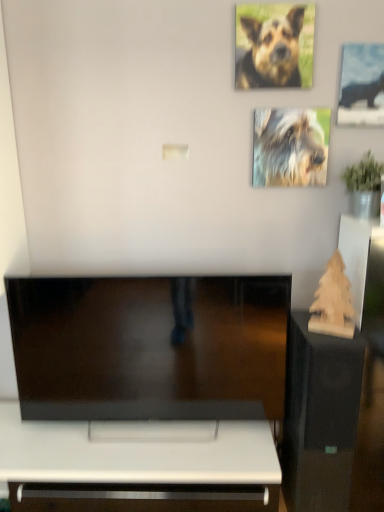
Describe the element at coordinates (271, 51) in the screenshot. I see `brown fur dog at upper right, which is the 1th dog from top to bottom` at that location.

This screenshot has height=512, width=384. What do you see at coordinates (361, 85) in the screenshot?
I see `metallic silver hippo at upper right` at bounding box center [361, 85].

This screenshot has height=512, width=384. What do you see at coordinates (333, 301) in the screenshot?
I see `wooden christmas tree at right` at bounding box center [333, 301].

Identify the location of brown fur dog at upper right, the 2th dog in the back-to-front sequence. This screenshot has height=512, width=384. 271,51.

Does brown fur dog at upper right, which is the 1th dog from top to bottom, appear on the right side of wooden sculpture at right?

No.

Which object is more forward, brown fur dog at upper right, which is the 1th dog from top to bottom, or wooden sculpture at right?

wooden sculpture at right is closer to the camera.

From a real-world perspective, is brown fur dog at upper right, positioned as the first dog in front-to-back order, above or below wooden sculpture at right?

Clearly, from a real-world perspective, brown fur dog at upper right, positioned as the first dog in front-to-back order, is above wooden sculpture at right.

Identify the location of furniture lying below the brown fur dog at upper right, which is the 1th dog from top to bottom (from the image's perspective). The height and width of the screenshot is (512, 384). (320, 417).

Which object is positioned more to the right, wooden sculpture at right or brown fur dog at upper right, positioned as the first dog in front-to-back order?

Positioned to the right is wooden sculpture at right.

From a real-world perspective, between wooden sculpture at right and brown fur dog at upper right, which is the 1th dog from top to bottom, who is vertically higher?

In real-world perspective, brown fur dog at upper right, which is the 1th dog from top to bottom, is above.

In terms of height, does wooden sculpture at right look taller or shorter compared to brown fur dog at upper right, the 2th dog in the back-to-front sequence?

Considering their sizes, wooden sculpture at right has more height than brown fur dog at upper right, the 2th dog in the back-to-front sequence.

From the picture: Is wooden sculpture at right wider or thinner than brown fur dog at upper right, which is the 1th dog from top to bottom?

Considering their sizes, wooden sculpture at right looks broader than brown fur dog at upper right, which is the 1th dog from top to bottom.

Measure the distance between wooden sculpture at right and shaggy fur dog at upper right, positioned as the 1th dog in back-to-front order.

They are 31.72 inches apart.

This screenshot has width=384, height=512. I want to click on furniture below the shaggy fur dog at upper right, positioned as the 1th dog in back-to-front order (from the image's perspective), so click(x=320, y=417).

Looking at this image, how many degrees apart are the facing directions of wooden sculpture at right and shaggy fur dog at upper right, arranged as the 1th dog when ordered from the bottom?

The angular difference between wooden sculpture at right and shaggy fur dog at upper right, arranged as the 1th dog when ordered from the bottom, is 0.479 degrees.

From a real-world perspective, is wooden sculpture at right positioned under shaggy fur dog at upper right, which ranks as the second dog in top-to-bottom order, based on gravity?

Indeed, from a real-world perspective, wooden sculpture at right is positioned beneath shaggy fur dog at upper right, which ranks as the second dog in top-to-bottom order.

From the picture: Is shaggy fur dog at upper right, which is the second dog from front to back, oriented away from brown fur dog at upper right, positioned as the first dog in front-to-back order?

shaggy fur dog at upper right, which is the second dog from front to back, is not turned away from brown fur dog at upper right, positioned as the first dog in front-to-back order.

From the image's perspective, between shaggy fur dog at upper right, arranged as the 1th dog when ordered from the bottom, and brown fur dog at upper right, arranged as the second dog when ordered from the bottom, which one is located above?

brown fur dog at upper right, arranged as the second dog when ordered from the bottom.

Is the surface of shaggy fur dog at upper right, positioned as the 1th dog in back-to-front order, in direct contact with brown fur dog at upper right, the 2th dog in the back-to-front sequence?

No, shaggy fur dog at upper right, positioned as the 1th dog in back-to-front order, is not touching brown fur dog at upper right, the 2th dog in the back-to-front sequence.

Considering the sizes of shaggy fur dog at upper right, which ranks as the second dog in top-to-bottom order, and brown fur dog at upper right, positioned as the first dog in front-to-back order, in the image, is shaggy fur dog at upper right, which ranks as the second dog in top-to-bottom order, taller or shorter than brown fur dog at upper right, positioned as the first dog in front-to-back order,?

Considering their sizes, shaggy fur dog at upper right, which ranks as the second dog in top-to-bottom order, has less height than brown fur dog at upper right, positioned as the first dog in front-to-back order.

Which of these two, wooden sculpture at right or wooden christmas tree at right, is thinner?

Thinner between the two is wooden christmas tree at right.

Considering the positions of points (301, 332) and (323, 288), is point (301, 332) closer to camera compared to point (323, 288)?

No, it is behind (323, 288).

Is wooden sculpture at right not near wooden christmas tree at right?

No.

Is wooden christmas tree at right turned away from brown fur dog at upper right, which is the 1th dog from top to bottom?

No, brown fur dog at upper right, which is the 1th dog from top to bottom, is not at the back of wooden christmas tree at right.

Considering the sizes of objects wooden christmas tree at right and brown fur dog at upper right, which is the 1th dog from top to bottom, in the image provided, who is wider, wooden christmas tree at right or brown fur dog at upper right, which is the 1th dog from top to bottom,?

wooden christmas tree at right is wider.

Which of these two, wooden christmas tree at right or brown fur dog at upper right, the 2th dog in the back-to-front sequence, is bigger?

wooden christmas tree at right is bigger.

Considering the points (333, 257) and (238, 85), which point is behind, point (333, 257) or point (238, 85)?

The point (238, 85) is behind.

Which object is positioned more to the right, shaggy fur dog at upper right, which ranks as the second dog in top-to-bottom order, or metallic silver hippo at upper right?

From the viewer's perspective, metallic silver hippo at upper right appears more on the right side.

From the image's perspective, between shaggy fur dog at upper right, which ranks as the second dog in top-to-bottom order, and metallic silver hippo at upper right, who is located below?

shaggy fur dog at upper right, which ranks as the second dog in top-to-bottom order, from the image's perspective.

Which dog is the 1st one when counting from the left side of the metallic silver hippo at upper right? Please provide its 2D coordinates.

[(291, 146)]

Image resolution: width=384 pixels, height=512 pixels. I want to click on the 2nd dog directly above the wooden sculpture at right (from a real-world perspective), so click(x=271, y=51).

In order to click on furniture that is below the brown fur dog at upper right, arranged as the second dog when ordered from the bottom (from the image's perspective) in this screenshot , I will do `click(320, 417)`.

Which object lies further to the anchor point wooden sculpture at right, metallic silver hippo at upper right or wooden christmas tree at right?

metallic silver hippo at upper right is positioned further to the anchor wooden sculpture at right.

When comparing their distances from wooden christmas tree at right, does shaggy fur dog at upper right, which ranks as the second dog in top-to-bottom order, or wooden sculpture at right seem closer?

wooden sculpture at right is positioned closer to the anchor wooden christmas tree at right.

When comparing their distances from shaggy fur dog at upper right, which is the second dog from front to back, does wooden christmas tree at right or wooden sculpture at right seem closer?

wooden christmas tree at right lies closer to shaggy fur dog at upper right, which is the second dog from front to back, than the other object.

When comparing their distances from shaggy fur dog at upper right, which is the second dog from front to back, does brown fur dog at upper right, the 2th dog in the back-to-front sequence, or wooden christmas tree at right seem further?

wooden christmas tree at right is positioned further to the anchor shaggy fur dog at upper right, which is the second dog from front to back.

Estimate the real-world distances between objects in this image. Which object is further from shaggy fur dog at upper right, arranged as the 1th dog when ordered from the bottom, metallic silver hippo at upper right or wooden christmas tree at right?

wooden christmas tree at right lies further to shaggy fur dog at upper right, arranged as the 1th dog when ordered from the bottom, than the other object.

Looking at the image, which one is located closer to wooden christmas tree at right, brown fur dog at upper right, the 2th dog in the back-to-front sequence, or wooden sculpture at right?

wooden sculpture at right.

Which object lies further to the anchor point wooden christmas tree at right, brown fur dog at upper right, positioned as the first dog in front-to-back order, or shaggy fur dog at upper right, which ranks as the second dog in top-to-bottom order?

brown fur dog at upper right, positioned as the first dog in front-to-back order, is further to wooden christmas tree at right.

Estimate the real-world distances between objects in this image. Which object is closer to brown fur dog at upper right, positioned as the first dog in front-to-back order, metallic silver hippo at upper right or shaggy fur dog at upper right, which ranks as the second dog in top-to-bottom order?

shaggy fur dog at upper right, which ranks as the second dog in top-to-bottom order, is closer to brown fur dog at upper right, positioned as the first dog in front-to-back order.

The image size is (384, 512). Find the location of `dog between brown fur dog at upper right, positioned as the first dog in front-to-back order, and wooden sculpture at right from top to bottom`. dog between brown fur dog at upper right, positioned as the first dog in front-to-back order, and wooden sculpture at right from top to bottom is located at coordinates (291, 146).

The height and width of the screenshot is (512, 384). I want to click on dog that lies between brown fur dog at upper right, which is the 1th dog from top to bottom, and wooden christmas tree at right from top to bottom, so click(291, 146).

Where is `dog between metallic silver hippo at upper right and wooden sculpture at right in the vertical direction`? dog between metallic silver hippo at upper right and wooden sculpture at right in the vertical direction is located at coordinates click(x=291, y=146).

At what (x,y) coordinates should I click in order to perform the action: click on art between shaggy fur dog at upper right, which ranks as the second dog in top-to-bottom order, and wooden sculpture at right in the up-down direction. Please return your answer as a coordinate pair (x, y). The height and width of the screenshot is (512, 384). Looking at the image, I should click on (333, 301).